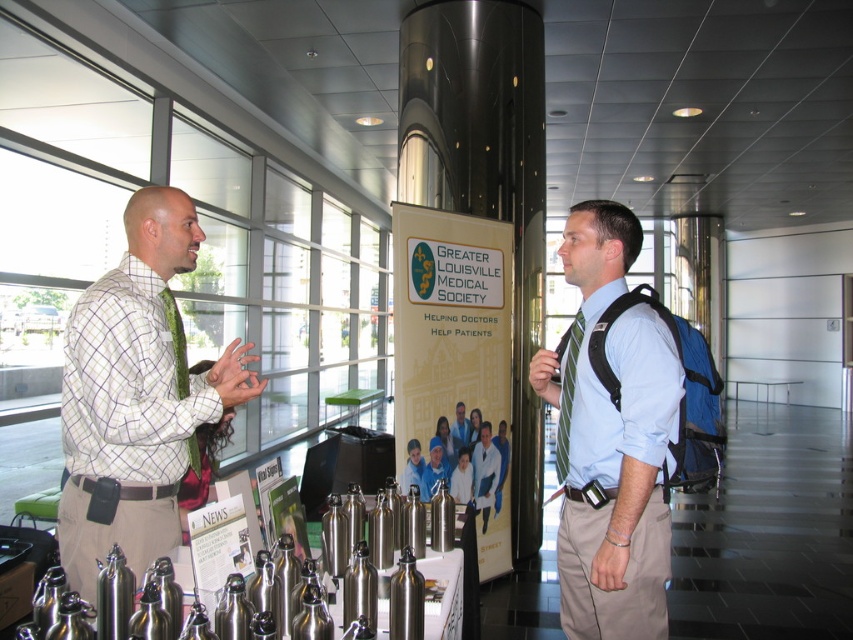
Question: Is yellow paper poster at center above light blue shirt at center?

Choices:
 (A) yes
 (B) no

Answer: (A)

Question: Which point is closer to the camera taking this photo?

Choices:
 (A) (73, 488)
 (B) (461, 426)
 (C) (405, 250)
 (D) (596, 444)

Answer: (A)

Question: Is plaid shirt at left to the right of yellow paper poster at center from the viewer's perspective?

Choices:
 (A) yes
 (B) no

Answer: (B)

Question: Does plaid shirt at left have a greater width compared to light blue shirt with tie at right?

Choices:
 (A) no
 (B) yes

Answer: (B)

Question: Considering the real-world distances, which object is closest to the light blue shirt with tie at right?

Choices:
 (A) plaid shirt at left
 (B) yellow paper poster at center

Answer: (A)

Question: Among these points, which one is nearest to the camera?

Choices:
 (A) (509, 230)
 (B) (456, 420)
 (C) (643, 404)
 (D) (178, 392)

Answer: (C)